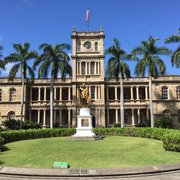
The height and width of the screenshot is (180, 180). Find the location of `1 statue`. 1 statue is located at coordinates (83, 128).